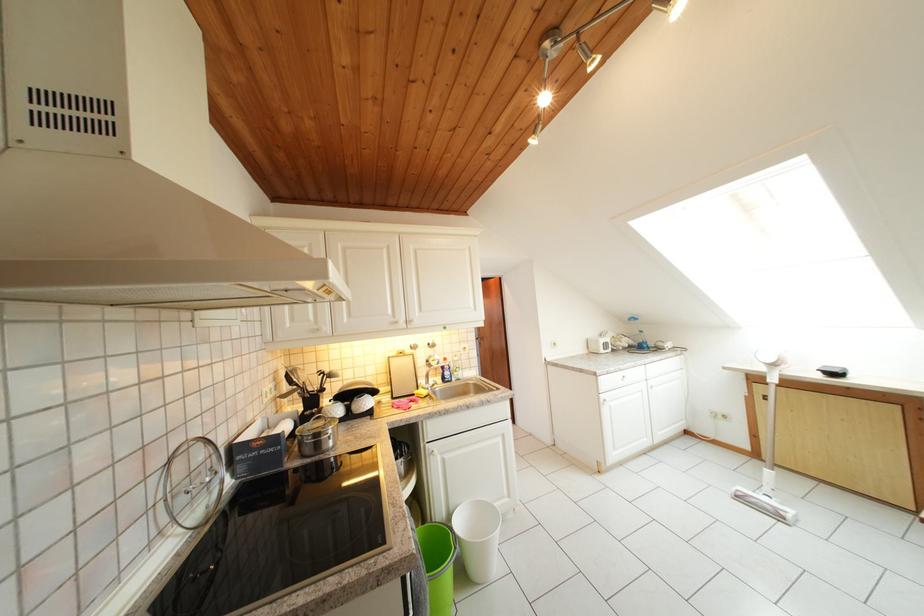
This screenshot has height=616, width=924. What are the coordinates of `vacuum cleaner handle` in the screenshot? It's located at (771, 411).